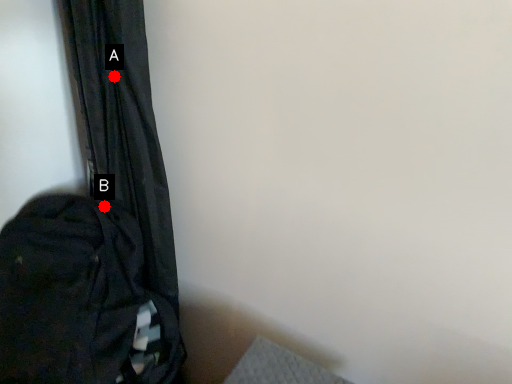
Question: Two points are circled on the image, labeled by A and B beside each circle. Which point is closer to the camera?

Choices:
 (A) A is closer
 (B) B is closer

Answer: (A)